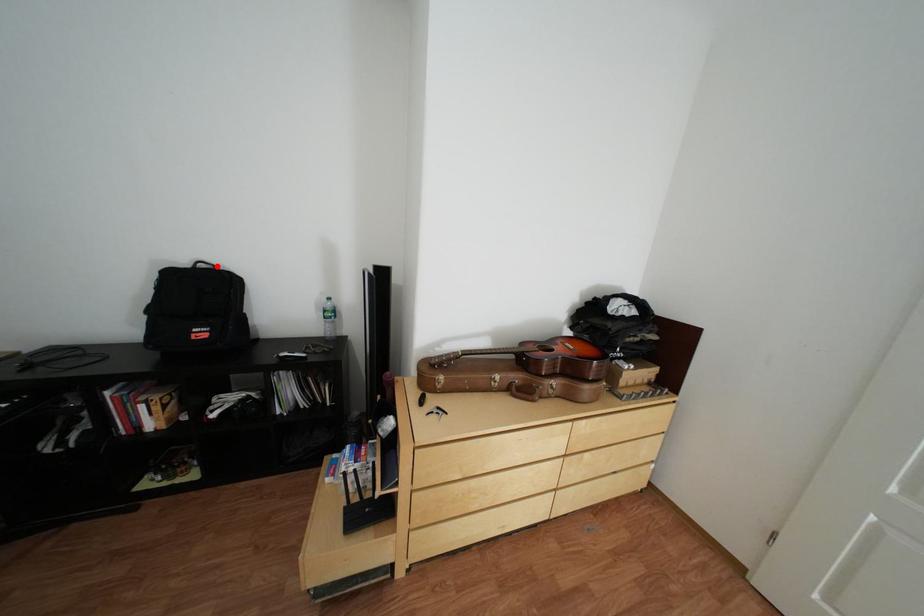
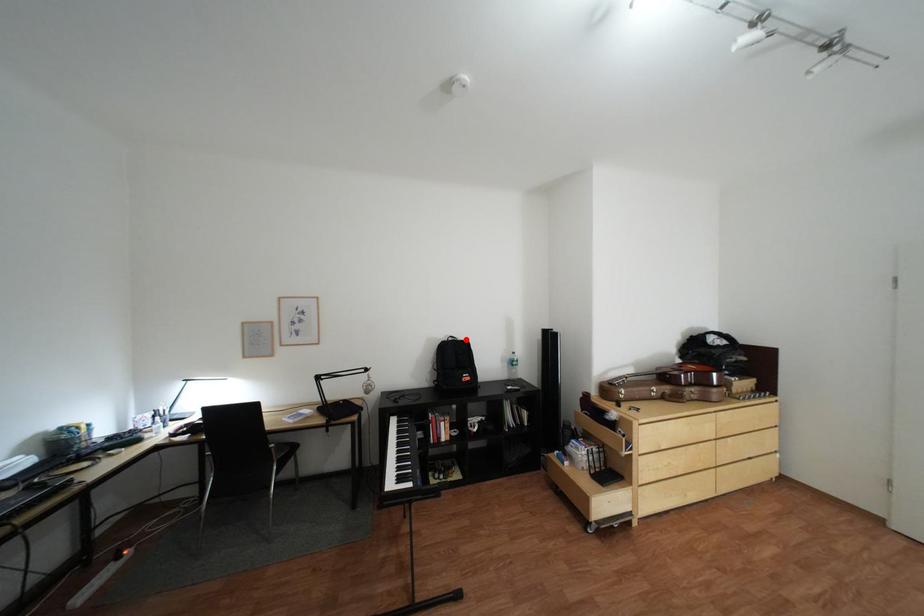
I am providing you with two images of the same scene from different viewpoints. A red point is marked on the first image and another point is marked on the second image. Is the marked point in image1 the same physical position as the marked point in image2?

Yes